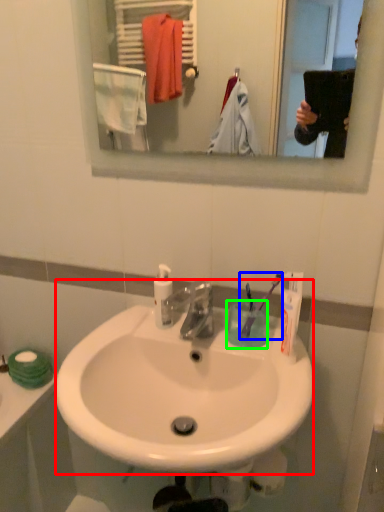
Question: Based on their relative distances, which object is nearer to sink (highlighted by a red box)? Choose from toothbrush (highlighted by a blue box) and coffee cup (highlighted by a green box).

Choices:
 (A) toothbrush
 (B) coffee cup

Answer: (B)